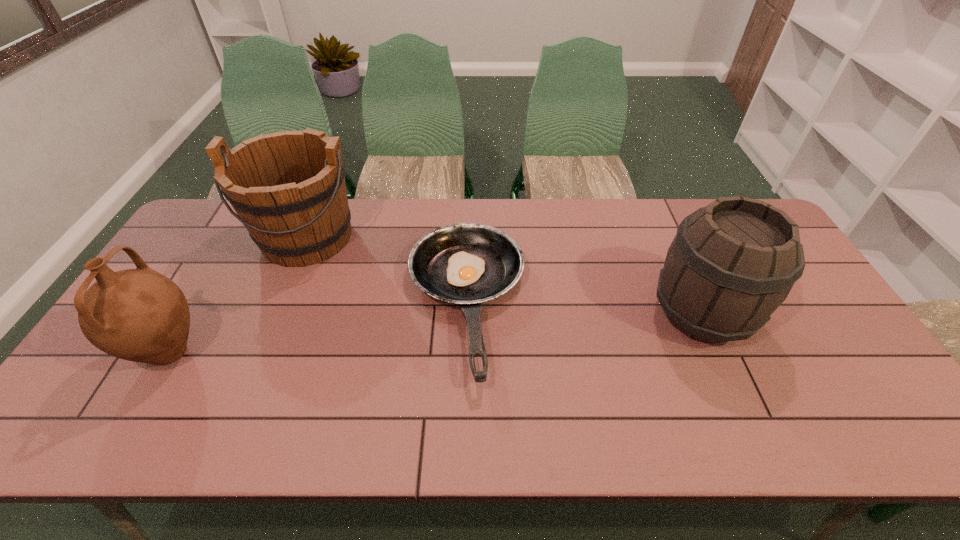
I want to click on free spot between the pitcher and the right wine bucket, so click(436, 333).

Find the location of a particular element. The height and width of the screenshot is (540, 960). unoccupied area between the rightmost object and the pitcher is located at coordinates (436, 333).

This screenshot has height=540, width=960. I want to click on free space between the second object from right to left and the rightmost object, so click(x=584, y=308).

At what (x,y) coordinates should I click in order to perform the action: click on free space between the left wine bucket and the shortest object. Please return your answer as a coordinate pair (x, y). Image resolution: width=960 pixels, height=540 pixels. Looking at the image, I should click on (387, 270).

Find the location of a particular element. The width and height of the screenshot is (960, 540). free space between the farther wine bucket and the frying pan is located at coordinates (387, 270).

You are a GUI agent. You are given a task and a screenshot of the screen. Output one action in this format:
    pyautogui.click(x=<x>, y=<y>)
    Task: Click on the second closest object to the right wine bucket
    Image resolution: width=960 pixels, height=540 pixels.
    Given the screenshot: What is the action you would take?
    pyautogui.click(x=288, y=188)

Find the location of a particular element. The image size is (960, 540). the second closest object to the farther wine bucket is located at coordinates (139, 315).

Locate an element on the screen. The width and height of the screenshot is (960, 540). free space that satisfies the following two spatial constraints: 1. on the side of the right wine bucket with the handle for carrying; 2. on the left side of the left wine bucket is located at coordinates (276, 314).

In order to click on vacant area that satisfies the following two spatial constraints: 1. on the side of the right wine bucket with the handle for carrying; 2. on the left side of the farther wine bucket in this screenshot , I will do `click(276, 314)`.

Find the location of `blank area in the image that satisfies the following two spatial constraints: 1. on the side of the left wine bucket with the handle for carrying; 2. on the right side of the third object from left to right`. blank area in the image that satisfies the following two spatial constraints: 1. on the side of the left wine bucket with the handle for carrying; 2. on the right side of the third object from left to right is located at coordinates (280, 303).